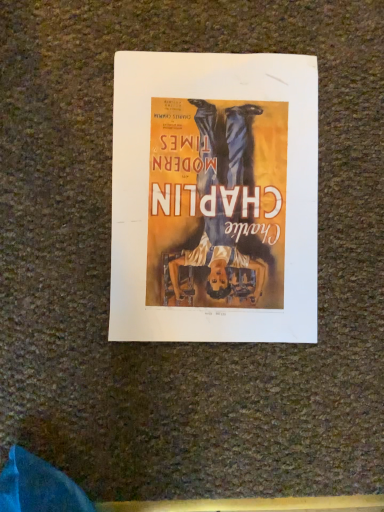
Find the location of `vacant space situated above matte paper poster at center (from a real-world perspective)`. vacant space situated above matte paper poster at center (from a real-world perspective) is located at coordinates (217, 195).